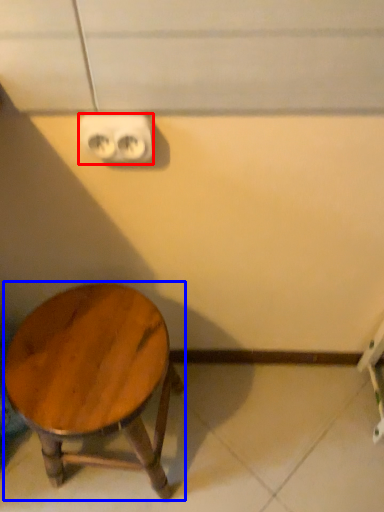
Question: Which object appears farthest to the camera in this image, electric outlet (highlighted by a red box) or stool (highlighted by a blue box)?

Choices:
 (A) electric outlet
 (B) stool

Answer: (B)